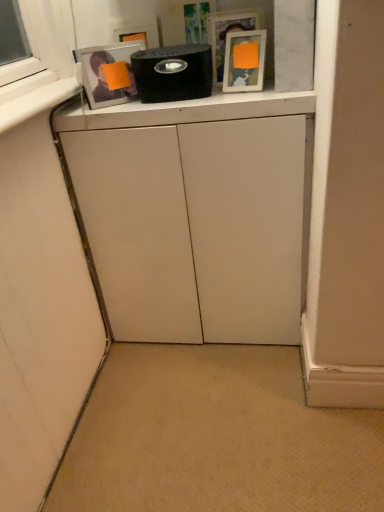
Question: Considering the positions of point (226, 76) and point (193, 53), is point (226, 76) closer or farther from the camera than point (193, 53)?

Choices:
 (A) farther
 (B) closer

Answer: (A)

Question: In terms of size, does matte white picture frame at upper center appear bigger or smaller than black matte speaker at upper center?

Choices:
 (A) small
 (B) big

Answer: (A)

Question: Estimate the real-world distances between objects in this image. Which object is farther from the matte white picture frame at upper center?

Choices:
 (A) black matte speaker at upper center
 (B) white matte cabinet at center

Answer: (B)

Question: Estimate the real-world distances between objects in this image. Which object is closer to the matte white picture frame at upper center?

Choices:
 (A) black matte speaker at upper center
 (B) white matte cabinet at center

Answer: (A)